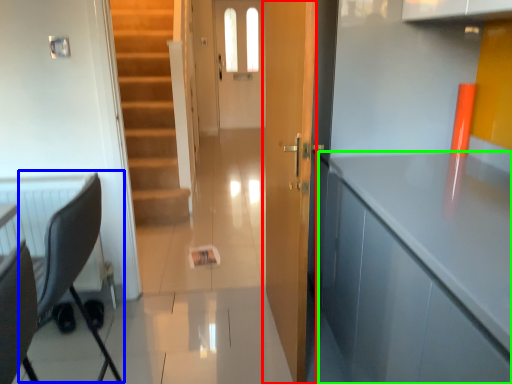
Question: Which object is the farthest from door (highlighted by a red box)? Choose among these: swivel chair (highlighted by a blue box) or cabinetry (highlighted by a green box).

Choices:
 (A) swivel chair
 (B) cabinetry

Answer: (A)